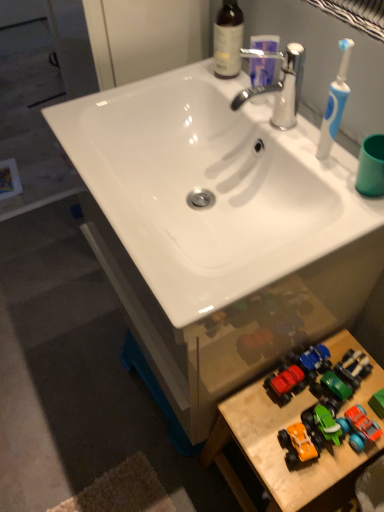
Locate an element on the screen. The width and height of the screenshot is (384, 512). vacant space in front of orange matte toy car at lower right is located at coordinates (299, 483).